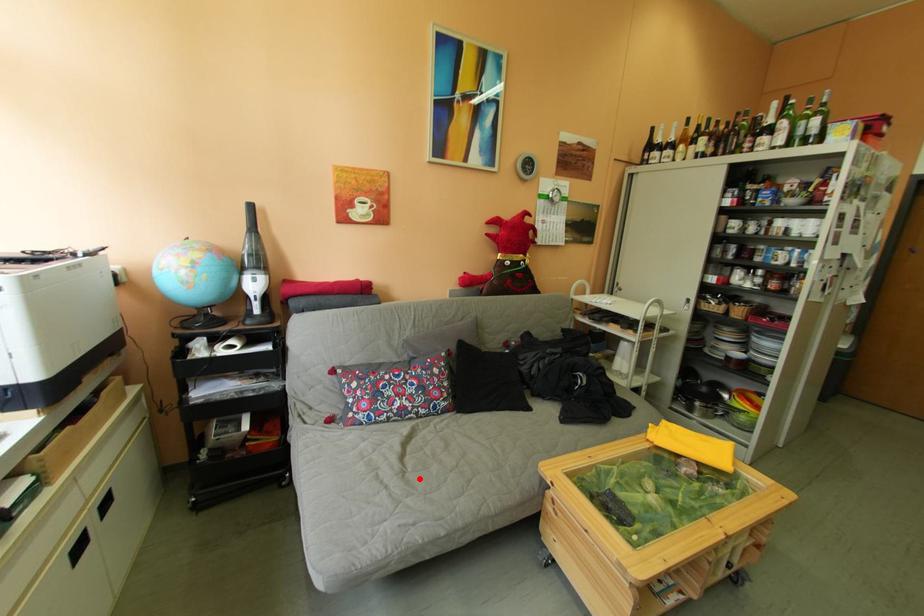
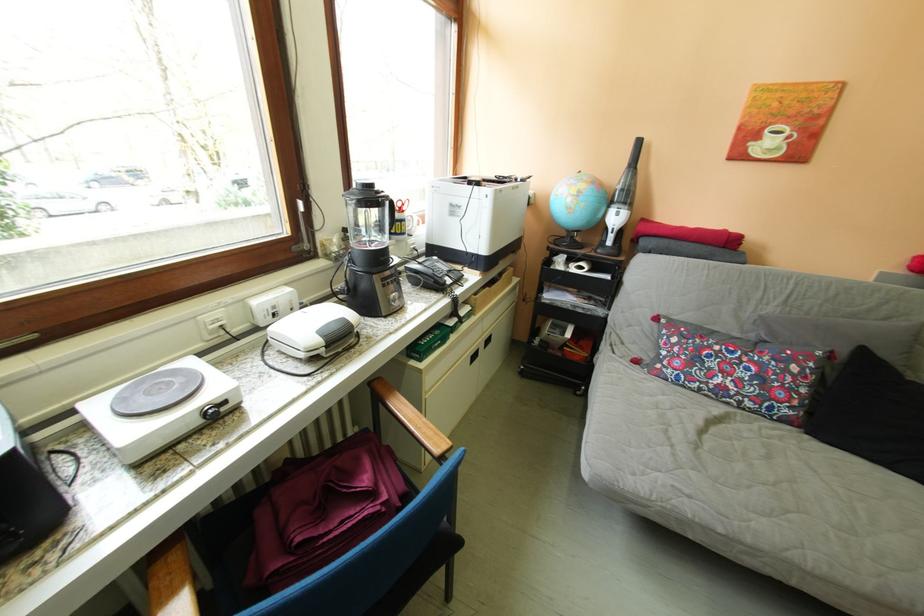
In the second image, find the point that corresponds to the highlighted location in the first image.

(713, 455)